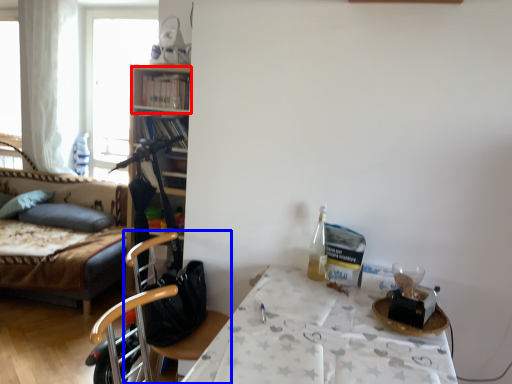
Question: Which object appears closest to the camera in this image, shelf (highlighted by a red box) or chair (highlighted by a blue box)?

Choices:
 (A) shelf
 (B) chair

Answer: (B)